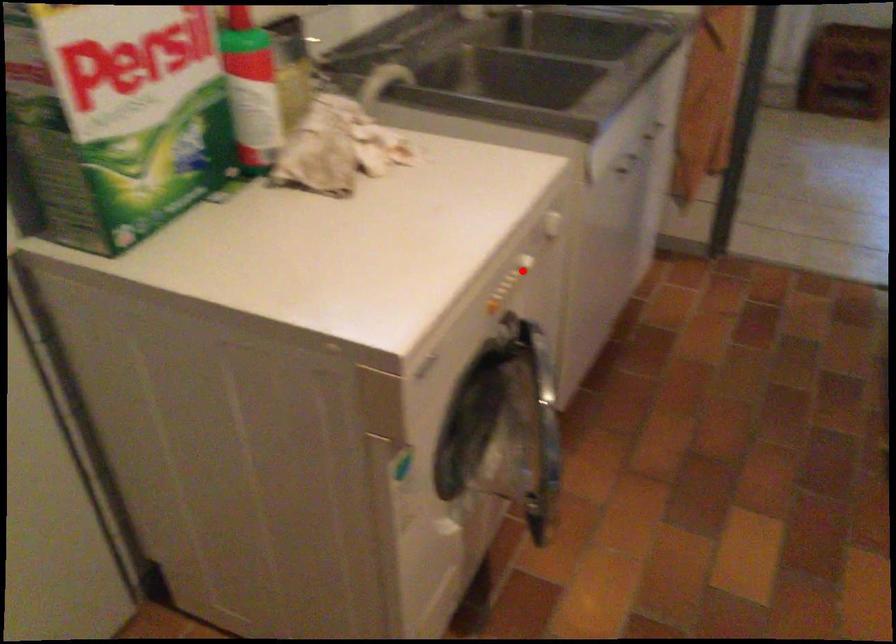
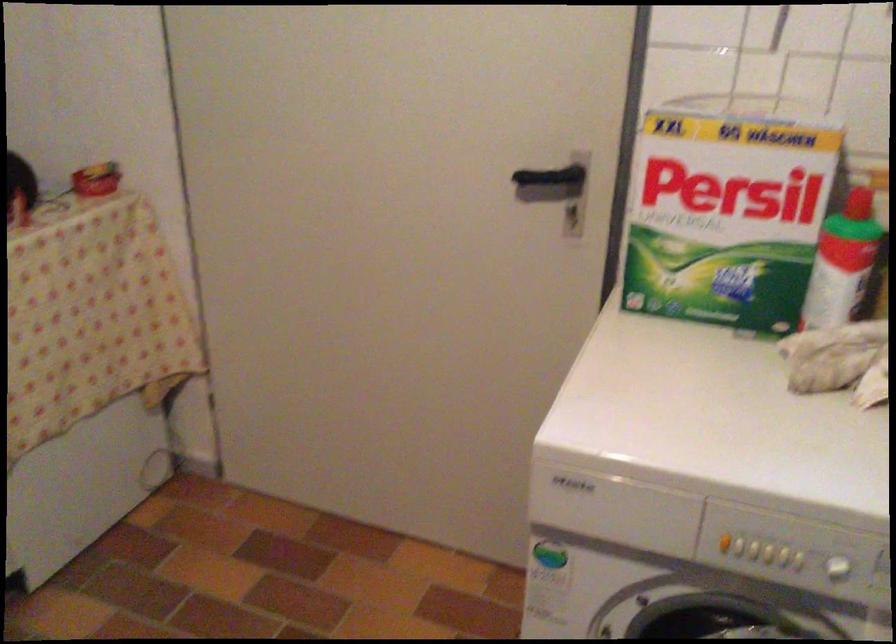
Question: I am providing you with two images of the same scene from different viewpoints. Image1 has a red point marked. In image2, the corresponding 3D location appears at what relative position? Reply with the corresponding letter.

Choices:
 (A) Closer
 (B) Farther

Answer: (A)